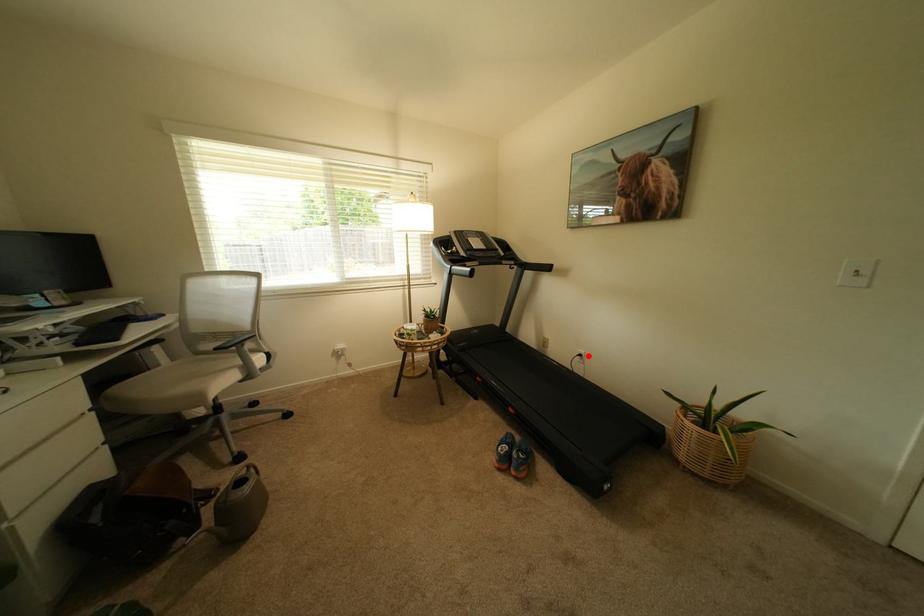
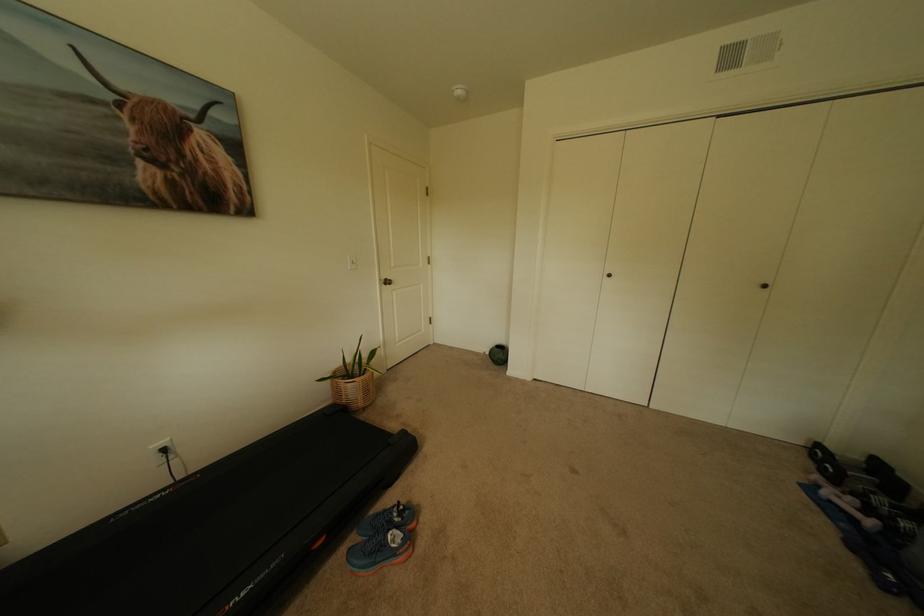
Where in the second image is the point corresponding to the highlighted location from the first image?

(173, 451)